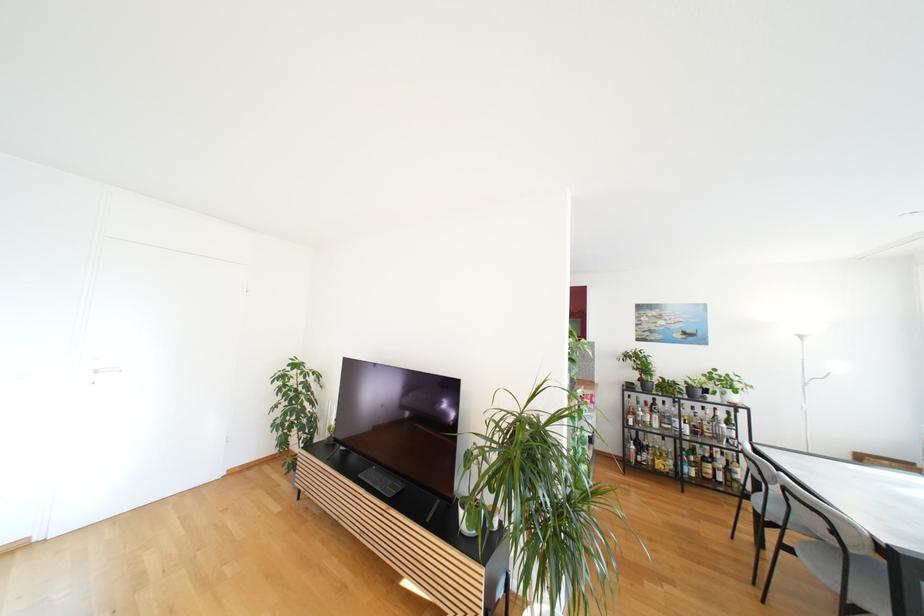
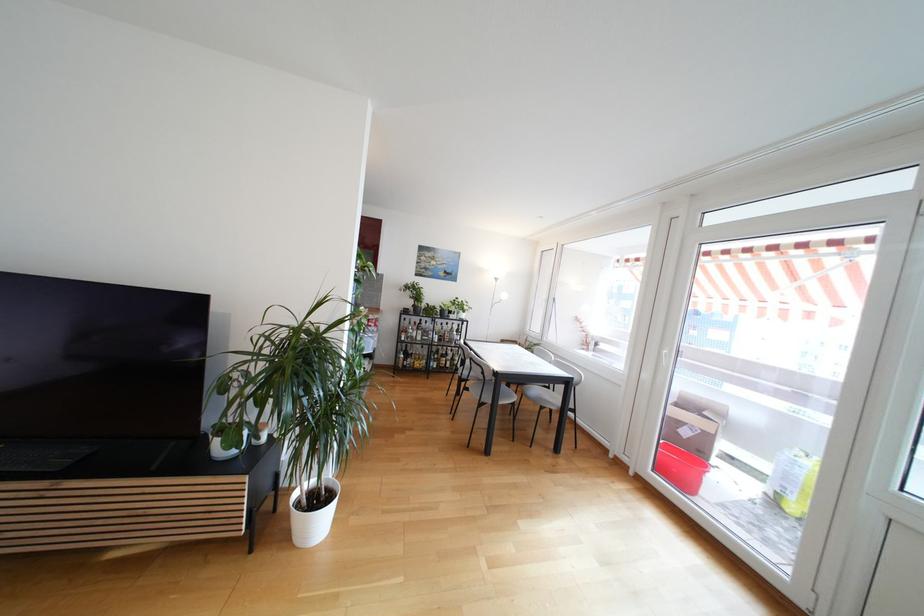
Find the pixel in the second image that matches point (654, 426) in the first image.

(419, 339)